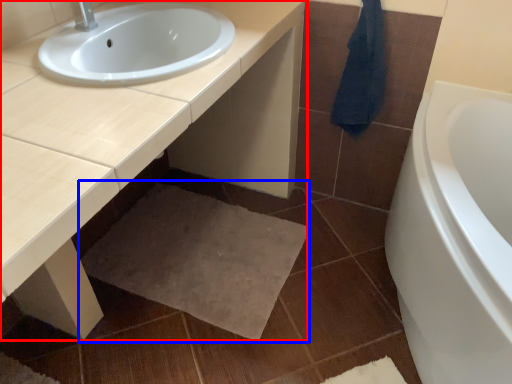
Question: Which of the following is the farthest to the observer, countertop (highlighted by a red box) or bath mat (highlighted by a blue box)?

Choices:
 (A) countertop
 (B) bath mat

Answer: (B)